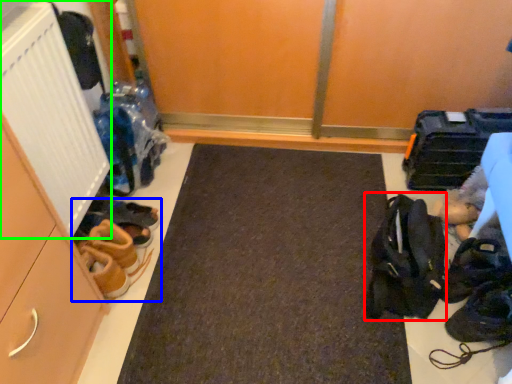
Question: Which object is the farthest from accessory (highlighted by a red box)? Choose among these: footwear (highlighted by a blue box) or radiator (highlighted by a green box).

Choices:
 (A) footwear
 (B) radiator

Answer: (B)